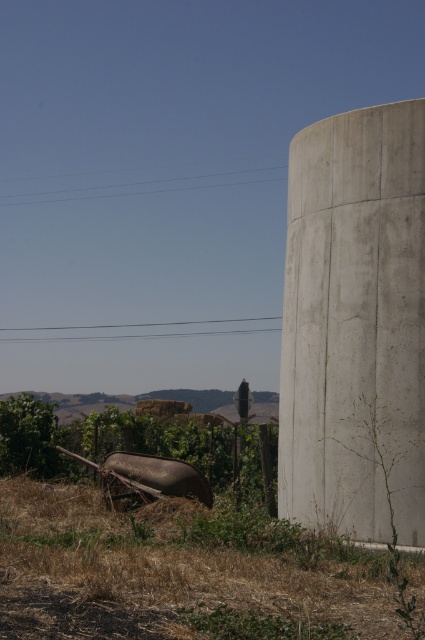
Question: Which of the following is the closest to the observer?

Choices:
 (A) (229, 592)
 (B) (326, 332)

Answer: (A)

Question: Is brown rusted wheelbarrow at lower left closer to camera compared to concrete at right?

Choices:
 (A) yes
 (B) no

Answer: (A)

Question: Estimate the real-world distances between objects in this image. Which object is farther from the brown rusted wheelbarrow at lower left?

Choices:
 (A) concrete at right
 (B) dry grass at right

Answer: (B)

Question: Which object appears closest to the camera in this image?

Choices:
 (A) brown rusted wheelbarrow at lower left
 (B) dry grass at right
 (C) concrete at right

Answer: (A)

Question: Does brown rusted wheelbarrow at lower left have a greater width compared to dry grass at right?

Choices:
 (A) yes
 (B) no

Answer: (A)

Question: Is brown rusted wheelbarrow at lower left to the right of concrete at right from the viewer's perspective?

Choices:
 (A) no
 (B) yes

Answer: (A)